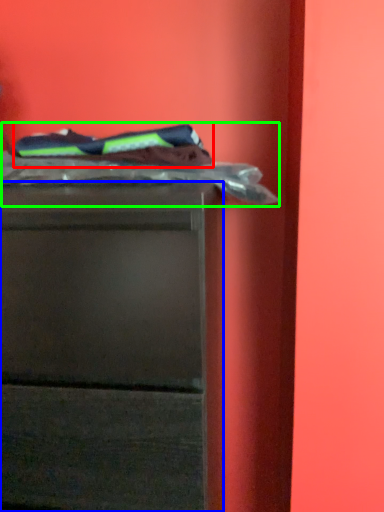
Question: Based on their relative distances, which object is nearer to laundry (highlighted by a red box)? Choose from chest of drawers (highlighted by a blue box) and laundry (highlighted by a green box).

Choices:
 (A) chest of drawers
 (B) laundry

Answer: (B)